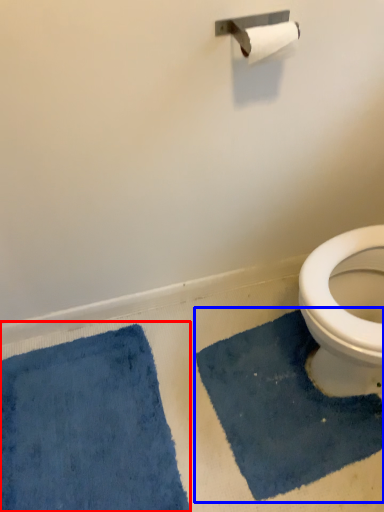
Question: Which point is further to the camera, bath mat (highlighted by a red box) or bath mat (highlighted by a blue box)?

Choices:
 (A) bath mat
 (B) bath mat

Answer: (B)